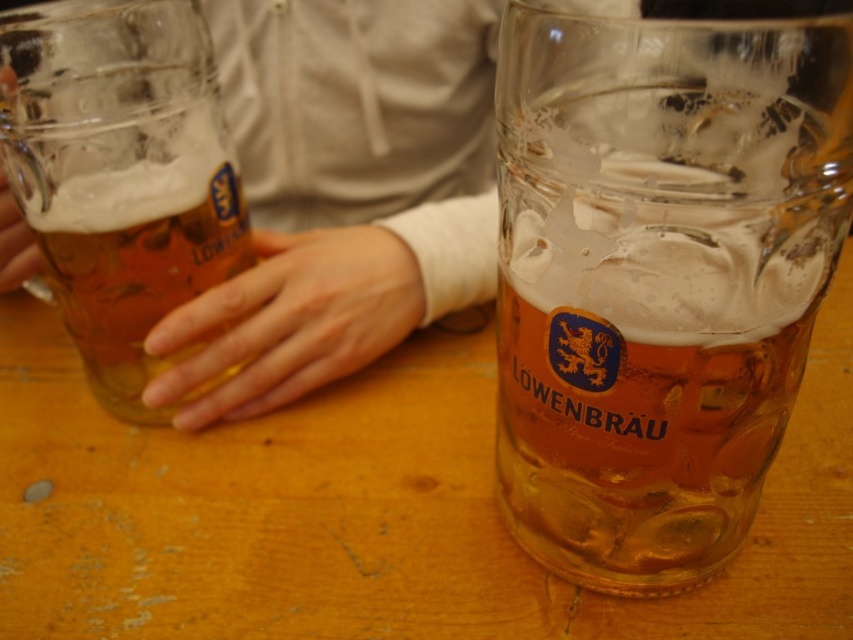
The width and height of the screenshot is (853, 640). What do you see at coordinates (120, 173) in the screenshot?
I see `translucent glass mug at left` at bounding box center [120, 173].

Is point (120, 104) positioned in front of point (22, 273)?

Yes, point (120, 104) is in front of point (22, 273).

The width and height of the screenshot is (853, 640). I want to click on translucent glass mug at left, so click(x=120, y=173).

Who is positioned more to the left, translucent glass mug at right or translucent glass mug at left?

From the viewer's perspective, translucent glass mug at left appears more on the left side.

Describe the element at coordinates (659, 276) in the screenshot. This screenshot has width=853, height=640. I see `translucent glass mug at right` at that location.

Is point (733, 422) more distant than point (80, 308)?

No, (733, 422) is in front of (80, 308).

Identify the location of translucent glass mug at right. (659, 276).

Measure the distance between translucent glass mug at left and smooth skin hand at center.

translucent glass mug at left and smooth skin hand at center are 2.60 inches apart from each other.

Is translucent glass mug at left in front of smooth skin hand at center?

Yes, translucent glass mug at left is in front of smooth skin hand at center.

What do you see at coordinates (120, 173) in the screenshot? I see `translucent glass mug at left` at bounding box center [120, 173].

I want to click on translucent glass mug at left, so click(x=120, y=173).